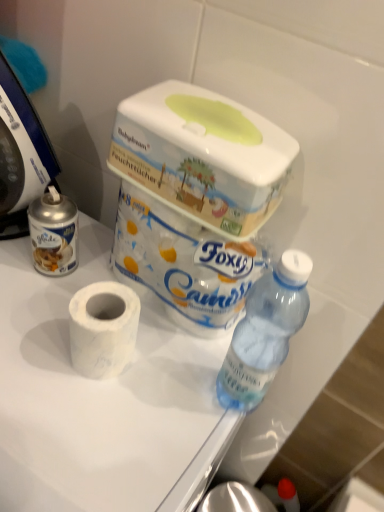
I want to click on free space in front of white marble toilet paper at center, arranged as the second toilet paper when ordered from the bottom, so click(129, 396).